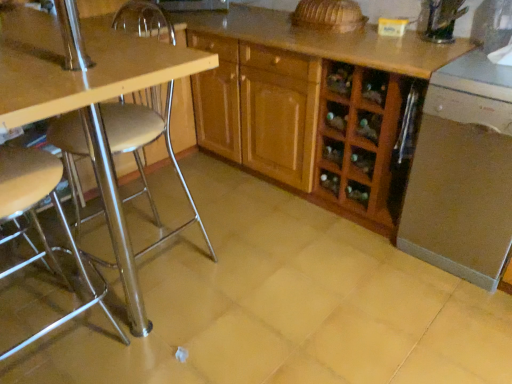
In order to click on free space in front of wooden table at left in this screenshot , I will do `click(174, 335)`.